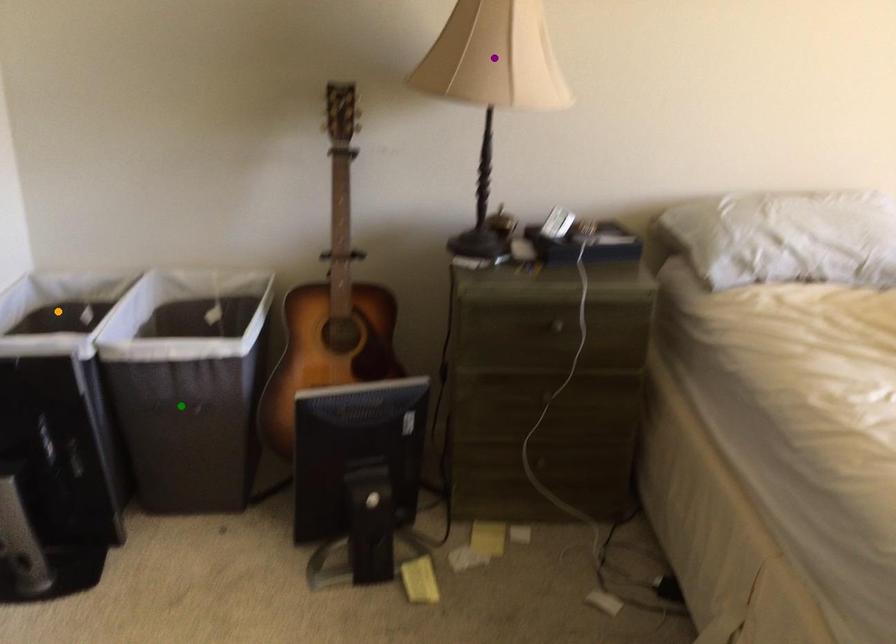
Order these from nearest to farthest:
1. orange point
2. green point
3. purple point

1. purple point
2. green point
3. orange point